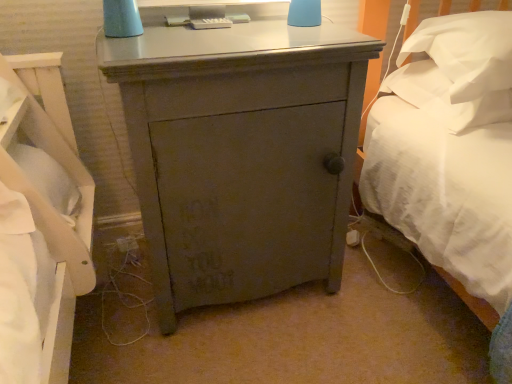
Question: Can you confirm if matte gray cabinet at center is taller than white soft pillow at right, the second pillow positioned from the top?

Choices:
 (A) no
 (B) yes

Answer: (B)

Question: Would you say matte gray cabinet at center is outside white soft pillow at right, the second pillow positioned from the top?

Choices:
 (A) yes
 (B) no

Answer: (A)

Question: Can you confirm if matte gray cabinet at center is wider than white soft pillow at right, marked as the 1th pillow in a bottom-to-top arrangement?

Choices:
 (A) no
 (B) yes

Answer: (B)

Question: Is the position of matte gray cabinet at center more distant than that of white soft pillow at right, marked as the 1th pillow in a bottom-to-top arrangement?

Choices:
 (A) no
 (B) yes

Answer: (A)

Question: Does matte gray cabinet at center have a lesser height compared to white soft pillow at right, marked as the 1th pillow in a bottom-to-top arrangement?

Choices:
 (A) yes
 (B) no

Answer: (B)

Question: Is matte gray cabinet at center in front of white soft pillow at right, marked as the 1th pillow in a bottom-to-top arrangement?

Choices:
 (A) no
 (B) yes

Answer: (B)

Question: From the image's perspective, does white soft pillow at upper right, which is counted as the 1th pillow, starting from the top, appear lower than matte gray cabinet at center?

Choices:
 (A) no
 (B) yes

Answer: (A)

Question: Is matte gray cabinet at center at the back of white soft pillow at upper right, which is counted as the 1th pillow, starting from the top?

Choices:
 (A) yes
 (B) no

Answer: (B)

Question: Is white soft pillow at upper right, the 2th pillow ordered from the bottom, wider than matte gray cabinet at center?

Choices:
 (A) yes
 (B) no

Answer: (B)

Question: Considering the relative sizes of white soft pillow at upper right, the 2th pillow ordered from the bottom, and matte gray cabinet at center in the image provided, is white soft pillow at upper right, the 2th pillow ordered from the bottom, bigger than matte gray cabinet at center?

Choices:
 (A) no
 (B) yes

Answer: (A)

Question: From the image's perspective, is white soft pillow at upper right, the 2th pillow ordered from the bottom, on top of matte gray cabinet at center?

Choices:
 (A) yes
 (B) no

Answer: (A)

Question: Is white soft pillow at upper right, which is counted as the 1th pillow, starting from the top, aimed at matte gray cabinet at center?

Choices:
 (A) no
 (B) yes

Answer: (A)

Question: Can you confirm if white soft pillow at upper right, which is counted as the 1th pillow, starting from the top, is positioned to the left of white soft pillow at right, marked as the 1th pillow in a bottom-to-top arrangement?

Choices:
 (A) no
 (B) yes

Answer: (A)